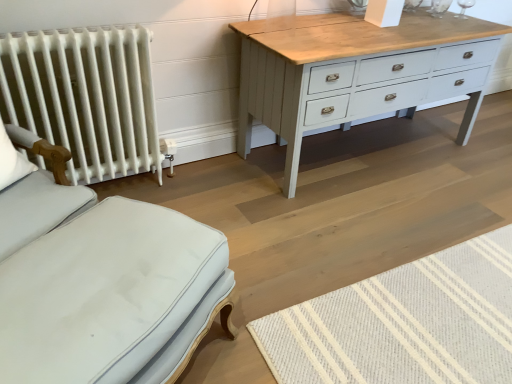
Question: Would you say light blue fabric ottoman at lower left is to the left or to the right of natural wool mat at lower right in the picture?

Choices:
 (A) right
 (B) left

Answer: (B)

Question: In the image, is light blue fabric ottoman at lower left positioned in front of or behind natural wool mat at lower right?

Choices:
 (A) behind
 (B) front

Answer: (B)

Question: Considering the real-world distances, which object is closest to the light blue fabric ottoman at lower left?

Choices:
 (A) natural wool mat at lower right
 (B) white painted radiator at left
 (C) white fabric pillow at left

Answer: (C)

Question: Based on their relative distances, which object is nearer to the white painted radiator at left?

Choices:
 (A) white fabric pillow at left
 (B) light blue fabric ottoman at lower left
 (C) natural wool mat at lower right

Answer: (A)